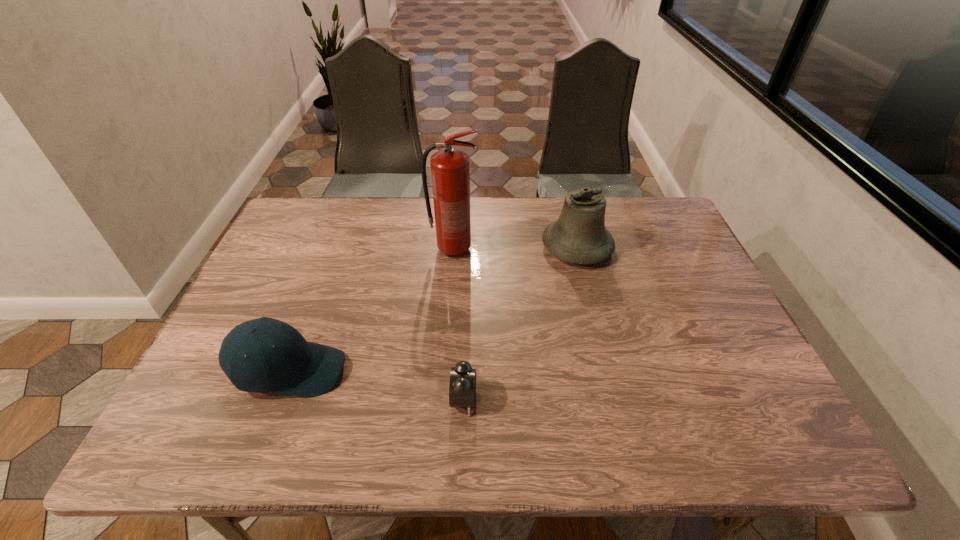
Identify which object is the nearest to the shortest object. Please provide its 2D coordinates. Your answer should be formatted as a tuple, i.e. [(x, y)], where the tuple contains the x and y coordinates of a point satisfying the conditions above.

[(293, 366)]